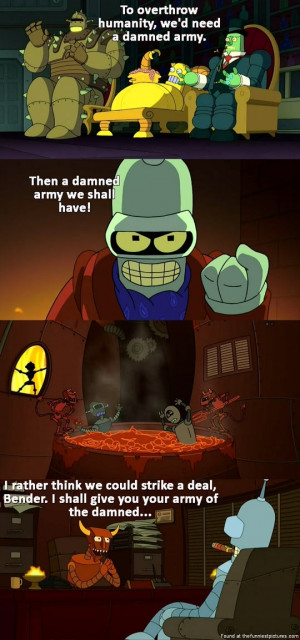
What are the coordinates of `desk` in the screenshot? It's located at (84, 614).